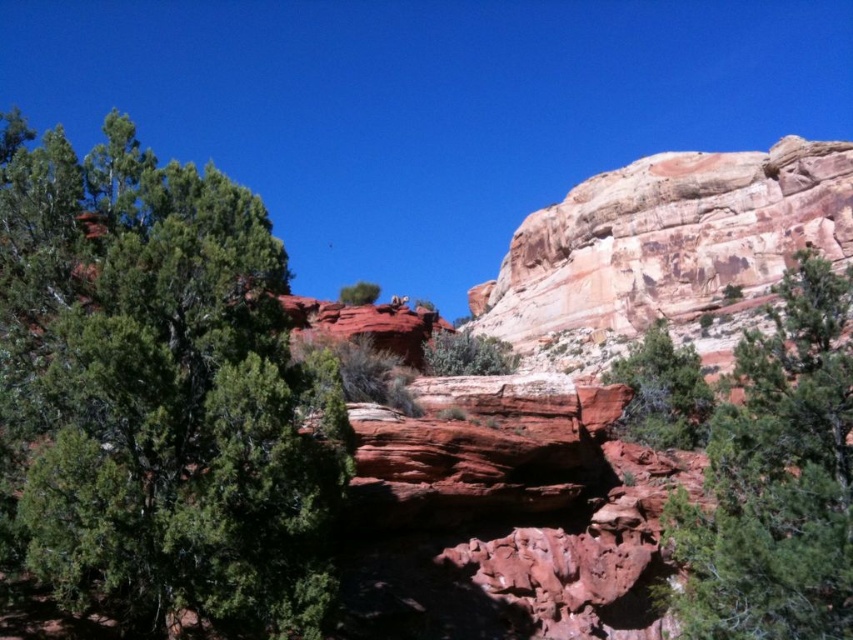
Which is in front, point (692, 412) or point (502, 342)?

Point (692, 412) is in front.

Is green matte tree at center bigger than green leafy shrub at center?

Yes, green matte tree at center is bigger than green leafy shrub at center.

Who is more distant from viewer, [636,413] or [479,356]?

Point [636,413]

What are the coordinates of `green matte tree at center` in the screenshot? It's located at (662, 392).

What do you see at coordinates (467, 355) in the screenshot? I see `green leafy shrub at center` at bounding box center [467, 355].

Based on the photo, is green leafy shrub at center positioned in front of green matte tree at upper center?

Yes, it is.

Where is `green leafy shrub at center`? The height and width of the screenshot is (640, 853). green leafy shrub at center is located at coordinates (467, 355).

Is green leafy tree at upper left further to camera compared to rustic sandstone cliff at upper right?

No, it is in front of rustic sandstone cliff at upper right.

Locate an element on the screen. green leafy tree at upper left is located at coordinates (161, 392).

I want to click on green leafy tree at upper left, so click(x=161, y=392).